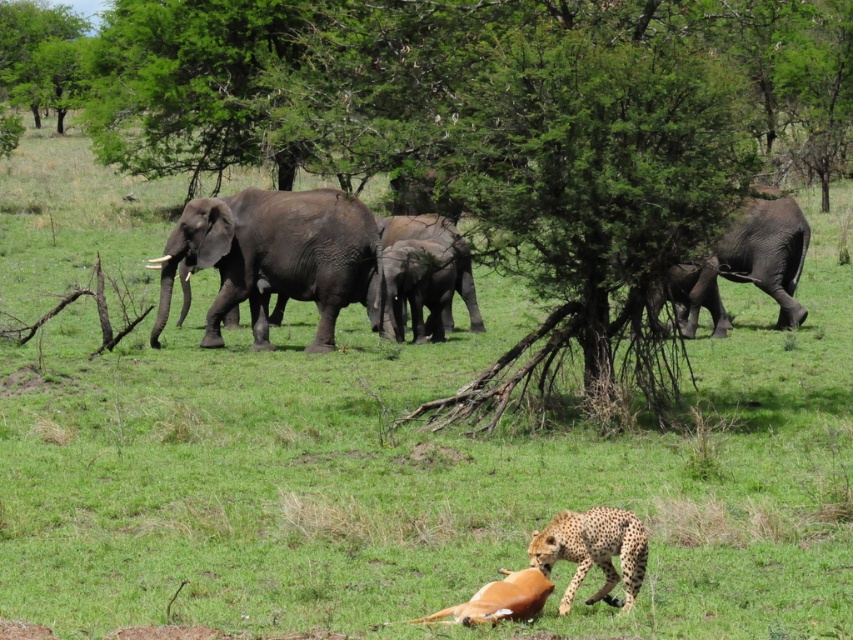
Question: Can you confirm if gray textured elephant at left is smaller than gray matte elephant at center?

Choices:
 (A) no
 (B) yes

Answer: (B)

Question: Can you confirm if spotted fur cheetah at lower center is smaller than gray matte elephant at center?

Choices:
 (A) no
 (B) yes

Answer: (B)

Question: Based on their relative distances, which object is farther from the spotted fur cheetah at lower center?

Choices:
 (A) gray textured elephant at right
 (B) gray textured elephant at left

Answer: (A)

Question: Which object is closer to the camera taking this photo?

Choices:
 (A) gray textured elephant at right
 (B) gray textured elephant at left
 (C) spotted fur cheetah at lower center
 (D) gray matte elephant at center

Answer: (C)

Question: Among these points, which one is farthest from the camera?

Choices:
 (A) (457, 268)
 (B) (735, 248)
 (C) (607, 561)
 (D) (247, 252)

Answer: (B)

Question: Is gray textured elephant at left above gray textured elephant at right?

Choices:
 (A) yes
 (B) no

Answer: (B)